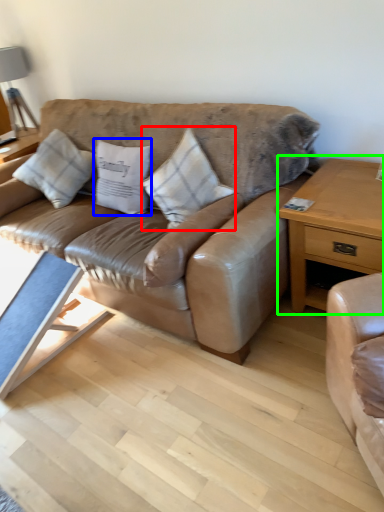
Question: Estimate the real-world distances between objects in this image. Which object is farther from pillow (highlighted by a red box), pillow (highlighted by a blue box) or nightstand (highlighted by a green box)?

Choices:
 (A) pillow
 (B) nightstand

Answer: (B)